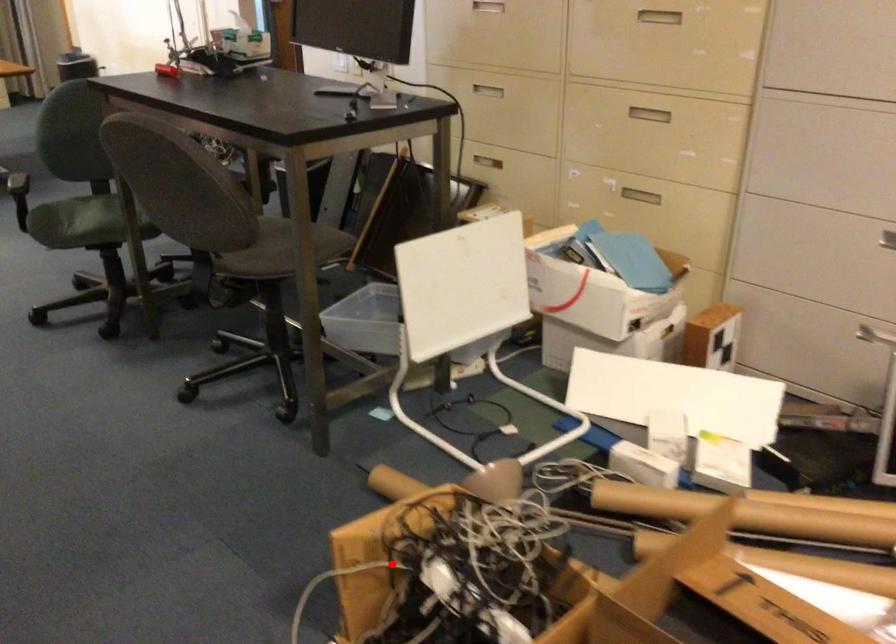
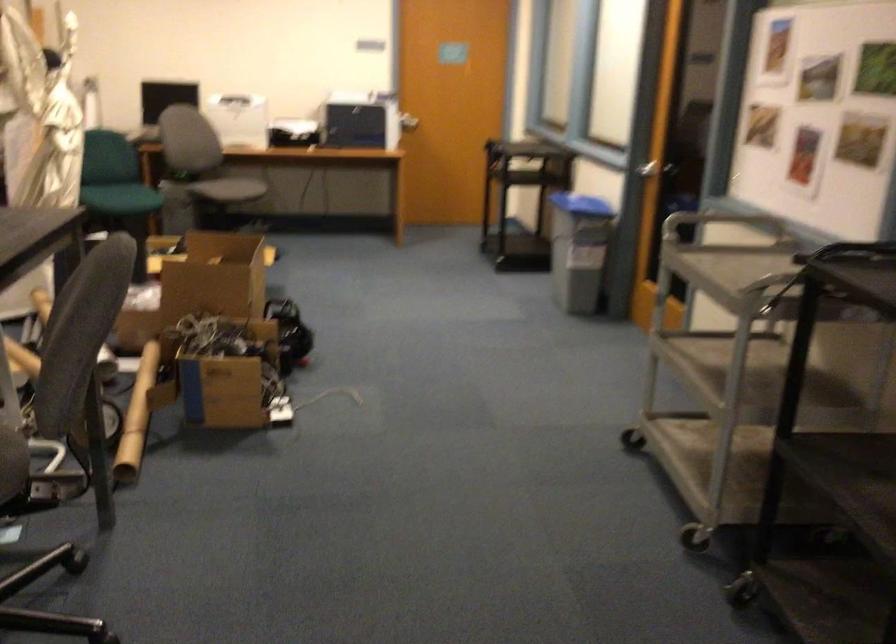
Question: I am providing you with two images of the same scene from different viewpoints. A red point is shown in image1. For the corresponding object point in image2, is it positioned nearer or farther from the camera?

Choices:
 (A) Nearer
 (B) Farther

Answer: (B)